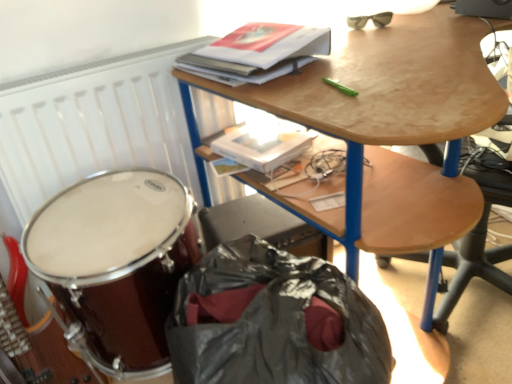
Question: Are white matte radiator at upper left and hardcover book at upper center making contact?

Choices:
 (A) yes
 (B) no

Answer: (B)

Question: From the image's perspective, is white matte radiator at upper left beneath hardcover book at upper center?

Choices:
 (A) yes
 (B) no

Answer: (A)

Question: Does white matte radiator at upper left have a greater width compared to hardcover book at upper center?

Choices:
 (A) yes
 (B) no

Answer: (B)

Question: Does white matte radiator at upper left have a smaller size compared to hardcover book at upper center?

Choices:
 (A) no
 (B) yes

Answer: (A)

Question: Is white matte radiator at upper left positioned before hardcover book at upper center?

Choices:
 (A) no
 (B) yes

Answer: (A)

Question: From the image's perspective, is white matte radiator at upper left positioned above or below wooden desk at upper center?

Choices:
 (A) above
 (B) below

Answer: (A)

Question: Considering their positions, is white matte radiator at upper left located in front of or behind wooden desk at upper center?

Choices:
 (A) front
 (B) behind

Answer: (B)

Question: In the image, is white matte radiator at upper left on the left side or the right side of wooden desk at upper center?

Choices:
 (A) right
 (B) left

Answer: (B)

Question: In terms of width, does white matte radiator at upper left look wider or thinner when compared to wooden desk at upper center?

Choices:
 (A) wide
 (B) thin

Answer: (B)

Question: Is point (361, 14) positioned closer to the camera than point (381, 33)?

Choices:
 (A) closer
 (B) farther

Answer: (B)

Question: Is matte black sunglasses at upper right inside the boundaries of wooden desk at upper center, or outside?

Choices:
 (A) outside
 (B) inside

Answer: (B)

Question: Visually, is matte black sunglasses at upper right positioned to the left or to the right of wooden desk at upper center?

Choices:
 (A) right
 (B) left

Answer: (B)

Question: Considering their positions, is matte black sunglasses at upper right located in front of or behind wooden desk at upper center?

Choices:
 (A) front
 (B) behind

Answer: (B)

Question: Do you think hardcover book at upper center is within wooden desk at upper center, or outside of it?

Choices:
 (A) outside
 (B) inside

Answer: (A)

Question: In the image, is hardcover book at upper center positioned in front of or behind wooden desk at upper center?

Choices:
 (A) front
 (B) behind

Answer: (B)